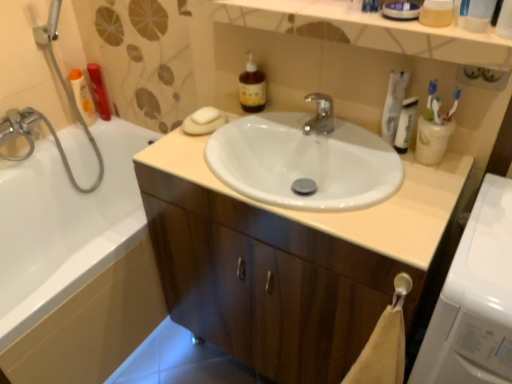
The image size is (512, 384). Identify the location of vacant space situated above white glossy sink at center (from a real-world perspective). (297, 137).